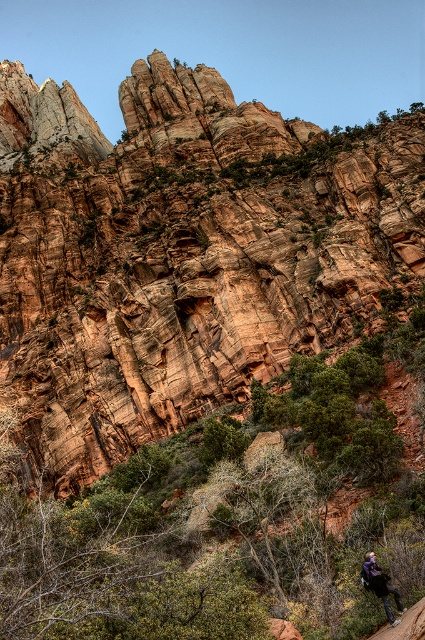
Question: Is the position of rustic rock formation at center more distant than that of purple fabric backpack at lower right?

Choices:
 (A) no
 (B) yes

Answer: (B)

Question: Observing the image, what is the correct spatial positioning of rustic rock formation at center in reference to purple fabric backpack at lower right?

Choices:
 (A) below
 (B) above

Answer: (B)

Question: Which point is farther to the camera?

Choices:
 (A) (379, 584)
 (B) (218, 141)

Answer: (B)

Question: Is rustic rock formation at center positioned in front of purple fabric backpack at lower right?

Choices:
 (A) yes
 (B) no

Answer: (B)